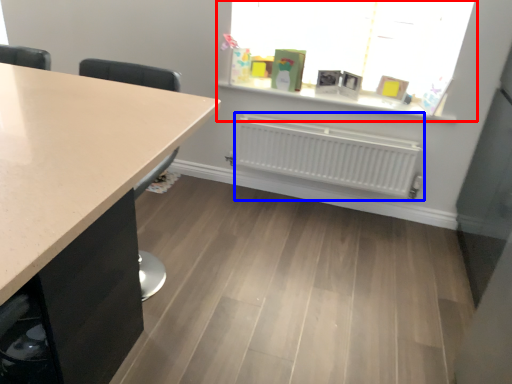
Question: Among these objects, which one is farthest to the camera, window (highlighted by a red box) or radiator (highlighted by a blue box)?

Choices:
 (A) window
 (B) radiator

Answer: (B)